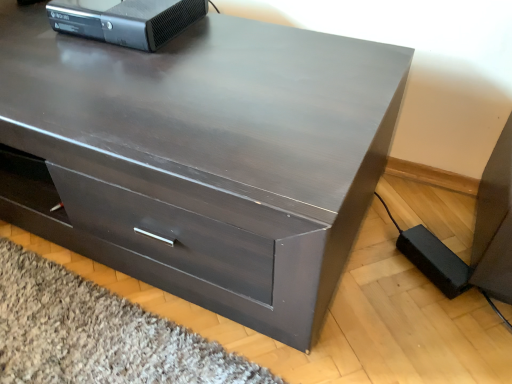
Locate an element on the screen. This screenshot has width=512, height=384. black plastic xbox 360 at upper left is located at coordinates (126, 20).

What do you see at coordinates (126, 20) in the screenshot? This screenshot has height=384, width=512. I see `black plastic xbox 360 at upper left` at bounding box center [126, 20].

Measure the distance between point (151, 50) and camera.

The depth of point (151, 50) is 34.80 inches.

What is the approximate height of black plastic xbox 360 at upper left?

2.99 inches.

This screenshot has height=384, width=512. What are the coordinates of `matte dark wood chest of drawers at center` in the screenshot? It's located at (202, 157).

Measure the distance between point (289, 118) and camera.

The depth of point (289, 118) is 27.80 inches.

Describe the element at coordinates (202, 157) in the screenshot. This screenshot has height=384, width=512. I see `matte dark wood chest of drawers at center` at that location.

Locate an element on the screen. The width and height of the screenshot is (512, 384). black plastic xbox 360 at upper left is located at coordinates (126, 20).

Which object is positioned more to the right, matte dark wood chest of drawers at center or black plastic xbox 360 at upper left?

From the viewer's perspective, black plastic xbox 360 at upper left appears more on the right side.

Which object is closer to the camera, matte dark wood chest of drawers at center or black plastic xbox 360 at upper left?

matte dark wood chest of drawers at center is more forward.

Is point (266, 210) positioned before point (125, 5)?

Yes, point (266, 210) is in front of point (125, 5).

From the image's perspective, is matte dark wood chest of drawers at center over black plastic xbox 360 at upper left?

No.

From a real-world perspective, between matte dark wood chest of drawers at center and black plastic xbox 360 at upper left, who is vertically lower?

matte dark wood chest of drawers at center.

Can you confirm if matte dark wood chest of drawers at center is wider than black plastic xbox 360 at upper left?

Yes.

From the picture: Is matte dark wood chest of drawers at center taller than black plastic xbox 360 at upper left?

Correct, matte dark wood chest of drawers at center is much taller as black plastic xbox 360 at upper left.

Based on their sizes in the image, would you say matte dark wood chest of drawers at center is bigger or smaller than black plastic xbox 360 at upper left?

matte dark wood chest of drawers at center is bigger than black plastic xbox 360 at upper left.

Is matte dark wood chest of drawers at center outside of black plastic xbox 360 at upper left?

Absolutely, matte dark wood chest of drawers at center is external to black plastic xbox 360 at upper left.

Is matte dark wood chest of drawers at center next to black plastic xbox 360 at upper left and touching it?

matte dark wood chest of drawers at center and black plastic xbox 360 at upper left are clearly separated.

Is matte dark wood chest of drawers at center oriented away from black plastic xbox 360 at upper left?

No.

Can you tell me how much matte dark wood chest of drawers at center and black plastic xbox 360 at upper left differ in facing direction?

There is a 1.21-degree angle between the facing directions of matte dark wood chest of drawers at center and black plastic xbox 360 at upper left.

Find the location of `desktop computer lying behind the matte dark wood chest of drawers at center`. desktop computer lying behind the matte dark wood chest of drawers at center is located at coordinates (126, 20).

Can you confirm if black plastic xbox 360 at upper left is positioned to the left of matte dark wood chest of drawers at center?

In fact, black plastic xbox 360 at upper left is to the right of matte dark wood chest of drawers at center.

Between black plastic xbox 360 at upper left and matte dark wood chest of drawers at center, which one is positioned in front?

Positioned in front is matte dark wood chest of drawers at center.

Is point (50, 24) closer to viewer compared to point (50, 112)?

No, (50, 24) is further to viewer.

From the image's perspective, is black plastic xbox 360 at upper left beneath matte dark wood chest of drawers at center?

Actually, black plastic xbox 360 at upper left appears above matte dark wood chest of drawers at center in the image.

From a real-world perspective, which is physically above, black plastic xbox 360 at upper left or matte dark wood chest of drawers at center?

black plastic xbox 360 at upper left, from a real-world perspective.

Considering the sizes of black plastic xbox 360 at upper left and matte dark wood chest of drawers at center in the image, is black plastic xbox 360 at upper left wider or thinner than matte dark wood chest of drawers at center?

In the image, black plastic xbox 360 at upper left appears to be more narrow than matte dark wood chest of drawers at center.

Which of these two, black plastic xbox 360 at upper left or matte dark wood chest of drawers at center, stands taller?

Standing taller between the two is matte dark wood chest of drawers at center.

Does black plastic xbox 360 at upper left have a smaller size compared to matte dark wood chest of drawers at center?

Yes, black plastic xbox 360 at upper left is smaller than matte dark wood chest of drawers at center.

Choose the correct answer: Is black plastic xbox 360 at upper left inside matte dark wood chest of drawers at center or outside it?

black plastic xbox 360 at upper left is located beyond the bounds of matte dark wood chest of drawers at center.

Is black plastic xbox 360 at upper left in contact with matte dark wood chest of drawers at center?

No, black plastic xbox 360 at upper left is not beside matte dark wood chest of drawers at center.

Is black plastic xbox 360 at upper left positioned with its back to matte dark wood chest of drawers at center?

black plastic xbox 360 at upper left does not have its back to matte dark wood chest of drawers at center.

I want to click on desktop computer located behind the matte dark wood chest of drawers at center, so click(x=126, y=20).

Locate an element on the screen. The image size is (512, 384). chest of drawers located on the left of black plastic xbox 360 at upper left is located at coordinates (202, 157).

Where is `chest of drawers below the black plastic xbox 360 at upper left (from a real-world perspective)`? chest of drawers below the black plastic xbox 360 at upper left (from a real-world perspective) is located at coordinates (202, 157).